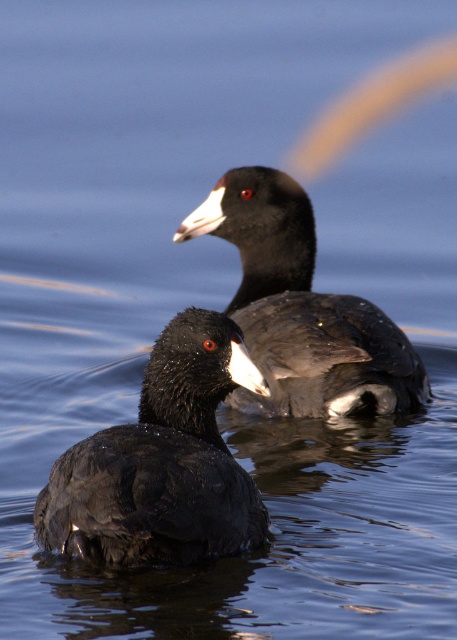
You are a wildlife photographer aiming to capture a photo of the black matte duck at center and the shiny black duck at center. Based on their positions, which duck should you focus on first to ensure both are in the frame?

The black matte duck at center is below the shiny black duck at center, so you should focus on the shiny black duck at center first to ensure both are in the frame.

You are a birdwatcher observing two ducks in the water. You see a black matte duck at center and a shiny black duck at center. Which duck is positioned to the left?

The black matte duck at center is positioned to the left of the shiny black duck at center.